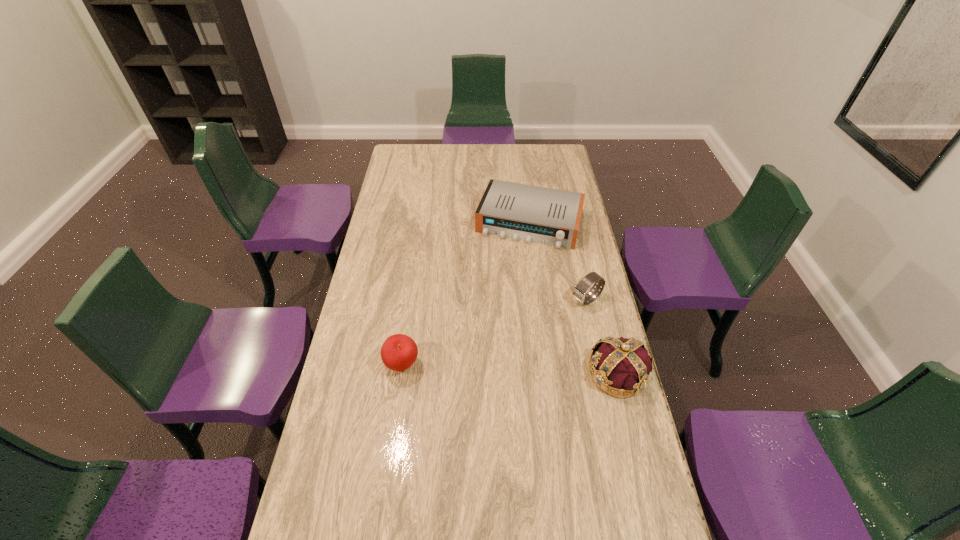
The width and height of the screenshot is (960, 540). I want to click on free spot on the desktop that is between the apple and the crown and is positioned on the face of the watch, so click(477, 368).

At what (x,y) coordinates should I click in order to perform the action: click on vacant spot on the desktop that is between the leftmost object and the tallest object and is positioned on the control panel of the radio receiver. Please return your answer as a coordinate pair (x, y). Looking at the image, I should click on (484, 368).